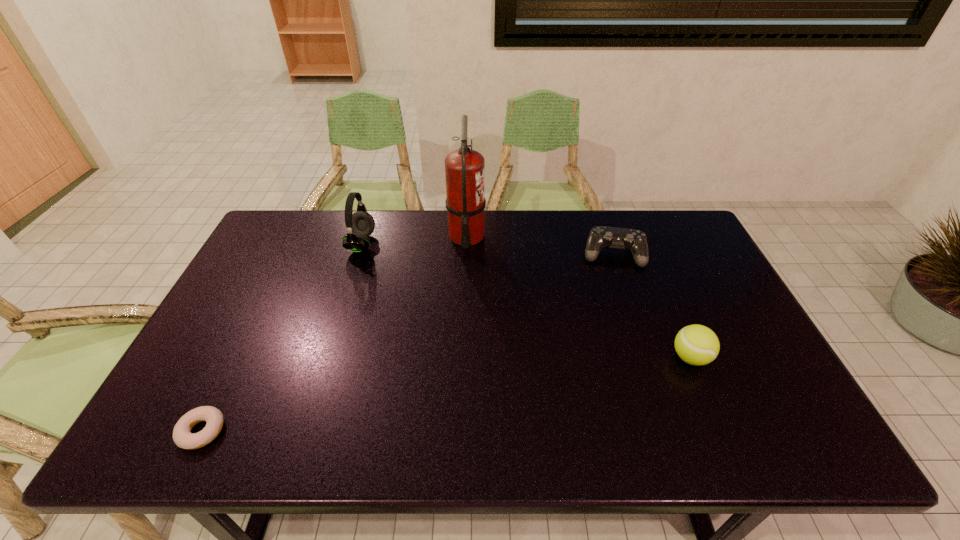
Locate an element on the screen. This screenshot has height=540, width=960. vacant space that's between the second shortest object and the fourth object from right to left is located at coordinates (488, 249).

Locate an element on the screen. This screenshot has width=960, height=540. free space between the doughnut and the headset is located at coordinates (281, 338).

The width and height of the screenshot is (960, 540). I want to click on free space that is in between the tennis ball and the headset, so click(x=526, y=300).

At what (x,y) coordinates should I click in order to perform the action: click on free space between the second tallest object and the leftmost object. Please return your answer as a coordinate pair (x, y). The width and height of the screenshot is (960, 540). Looking at the image, I should click on (281, 338).

Locate an element on the screen. This screenshot has width=960, height=540. unoccupied position between the tallest object and the control is located at coordinates (540, 245).

Locate which object ranks in proximity to the shortest object. Please provide its 2D coordinates. Your answer should be formatted as a tuple, i.e. [(x, y)], where the tuple contains the x and y coordinates of a point satisfying the conditions above.

[(360, 225)]

Image resolution: width=960 pixels, height=540 pixels. In order to click on object that is the third closest to the second tallest object in this screenshot , I will do `click(620, 238)`.

Identify the location of free spot that satisfies the following two spatial constraints: 1. toward the nozzle of the second shortest object; 2. on the left side of the fire extinguisher. Image resolution: width=960 pixels, height=540 pixels. (466, 255).

Find the location of a particular element. The height and width of the screenshot is (540, 960). free space that satisfies the following two spatial constraints: 1. toward the nozzle of the fire extinguisher; 2. on the left side of the second shortest object is located at coordinates (466, 255).

What are the coordinates of `vacant space that satisfies the following two spatial constraints: 1. toward the nozzle of the third object from left to right; 2. on the left side of the tennis ball` in the screenshot? It's located at (462, 357).